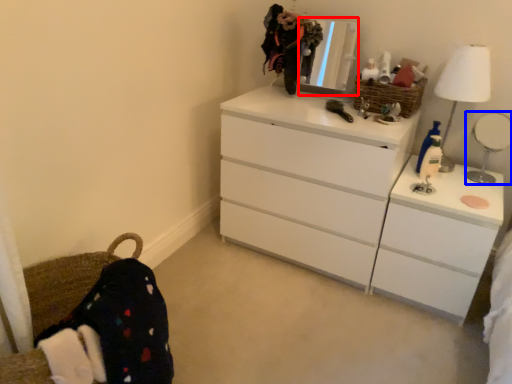
Question: Among these objects, which one is nearest to the camera, mirror (highlighted by a red box) or reflection (highlighted by a blue box)?

Choices:
 (A) mirror
 (B) reflection

Answer: (B)